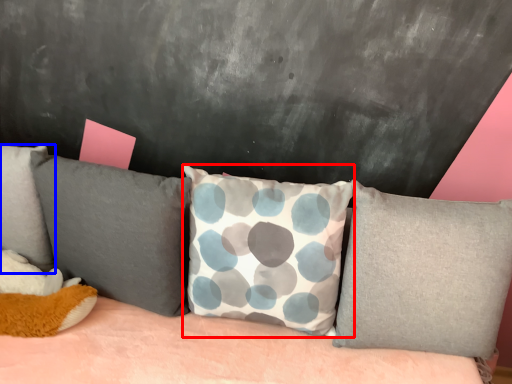
Question: Which point is further to the camera, pillow (highlighted by a red box) or pillow (highlighted by a blue box)?

Choices:
 (A) pillow
 (B) pillow

Answer: (B)